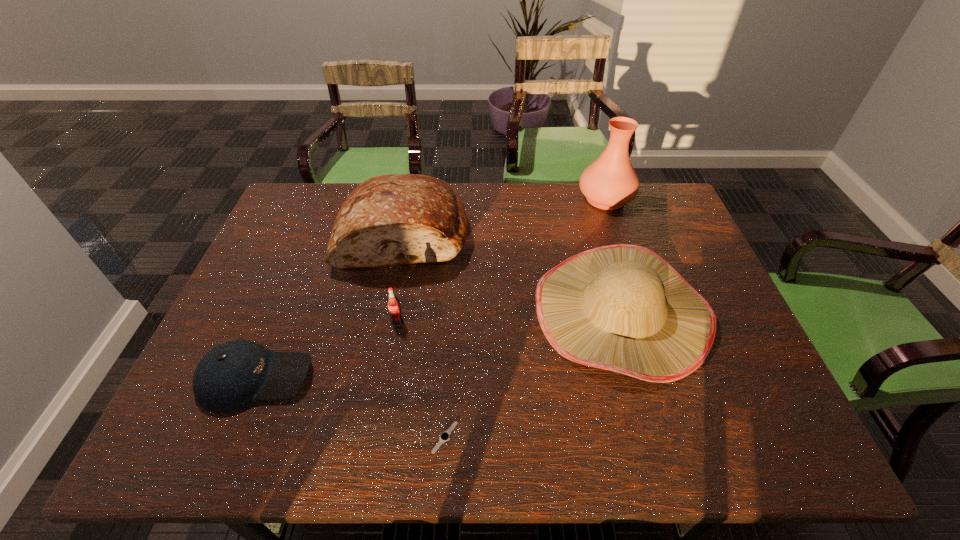
This screenshot has width=960, height=540. I want to click on vase, so click(608, 183).

Find the location of a particular element. The image size is (960, 540). bread is located at coordinates (396, 219).

You are a GUI agent. You are given a task and a screenshot of the screen. Output one action in this format:
    pyautogui.click(x=<x>, y=<y>)
    Task: Click on the sunhat
    
    Given the screenshot: What is the action you would take?
    pyautogui.click(x=622, y=307)

The image size is (960, 540). What are the coordinates of `the fourth tallest object` in the screenshot? It's located at (393, 303).

The width and height of the screenshot is (960, 540). What are the coordinates of `the fifth tallest object` in the screenshot? It's located at (232, 375).

This screenshot has width=960, height=540. Find the location of `the shortest object`. the shortest object is located at coordinates (445, 436).

Where is `the nearest object`? The image size is (960, 540). the nearest object is located at coordinates (445, 436).

What are the coordinates of `blank space located on the left of the vase` in the screenshot? It's located at (481, 198).

What are the coordinates of `free space located at the sliced front of the second tallest object` in the screenshot? It's located at (377, 380).

In order to click on vacant space located on the back of the sunhat in this screenshot , I will do `click(588, 195)`.